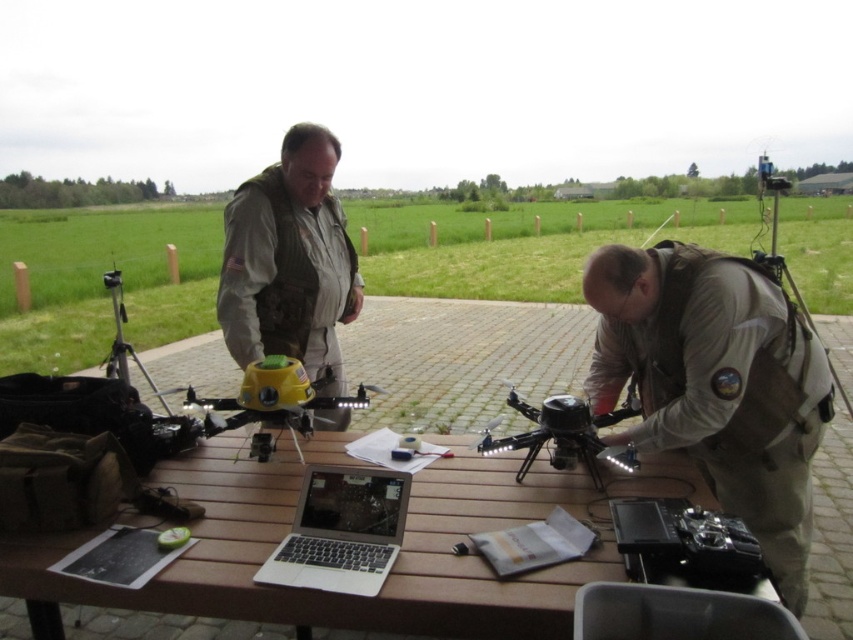
Question: Is black matte drone at center closer to the viewer compared to black matte tripod at left?

Choices:
 (A) no
 (B) yes

Answer: (B)

Question: Which object appears farthest from the camera in this image?

Choices:
 (A) silver metallic laptop at center
 (B) black matte tripod at left

Answer: (B)

Question: Which point is closer to the camera taking this photo?

Choices:
 (A) (340, 317)
 (B) (519, 444)

Answer: (B)

Question: Is tan uniform at center to the left of black matte tripod at left from the viewer's perspective?

Choices:
 (A) yes
 (B) no

Answer: (B)

Question: Which point is farther to the camera?

Choices:
 (A) (234, 273)
 (B) (685, 344)

Answer: (A)

Question: In this image, where is wooden table at center located relative to camouflage fabric vest at center?

Choices:
 (A) right
 (B) left

Answer: (A)